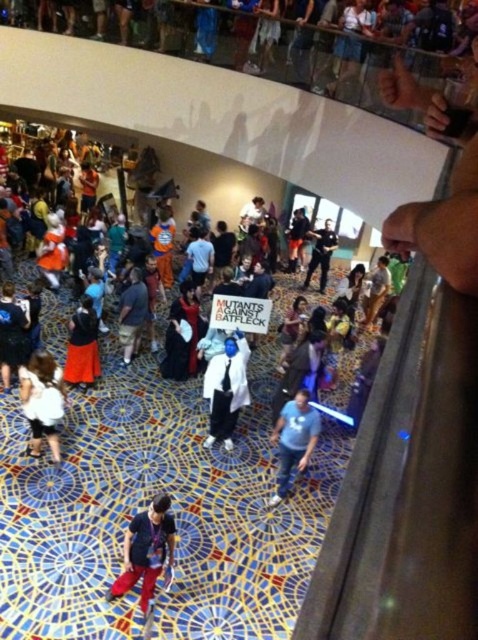
Question: Is white matte suit at center wider than matte black suit at center?

Choices:
 (A) no
 (B) yes

Answer: (A)

Question: Can you confirm if white matte suit at center is bigger than matte black suit at center?

Choices:
 (A) yes
 (B) no

Answer: (B)

Question: Can you confirm if white matte shirt at lower left is smaller than blue cotton shirt at center?

Choices:
 (A) no
 (B) yes

Answer: (B)

Question: Which is farther from the dark blue fabric pants at center?

Choices:
 (A) dark blue fabric shirt at center
 (B) white matte suit at center
 (C) blue cotton shirt at center
 (D) velvet black cape at lower left

Answer: (A)

Question: Considering the real-world distances, which object is closest to the dark blue fabric pants at center?

Choices:
 (A) white matte shirt at lower left
 (B) velvet black cape at lower left
 (C) dark blue fabric shirt at center

Answer: (A)

Question: Which object is the farthest from the white matte suit at center?

Choices:
 (A) matte black suit at center
 (B) white matte shirt at lower left

Answer: (A)